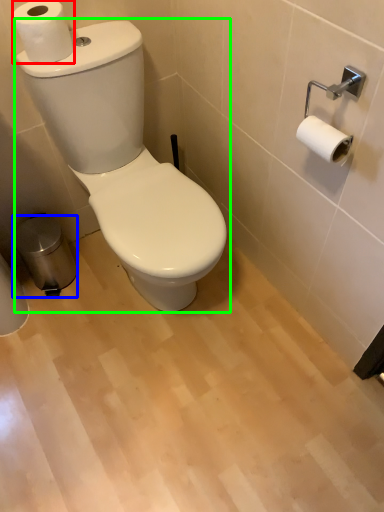
Question: Considering the real-world distances, which object is closest to toilet paper (highlighted by a red box)? trash bin/can (highlighted by a blue box) or toilet (highlighted by a green box).

Choices:
 (A) trash bin/can
 (B) toilet

Answer: (B)